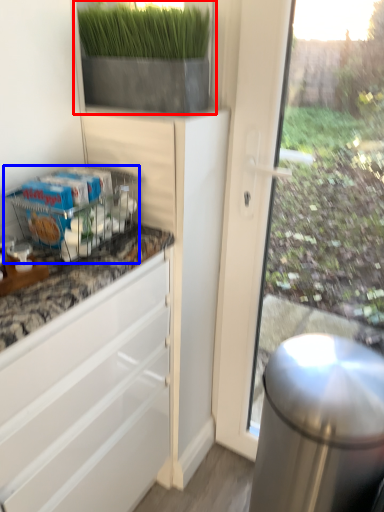
Question: Among these objects, which one is nearest to the camera, houseplant (highlighted by a red box) or shelf (highlighted by a blue box)?

Choices:
 (A) houseplant
 (B) shelf

Answer: (B)